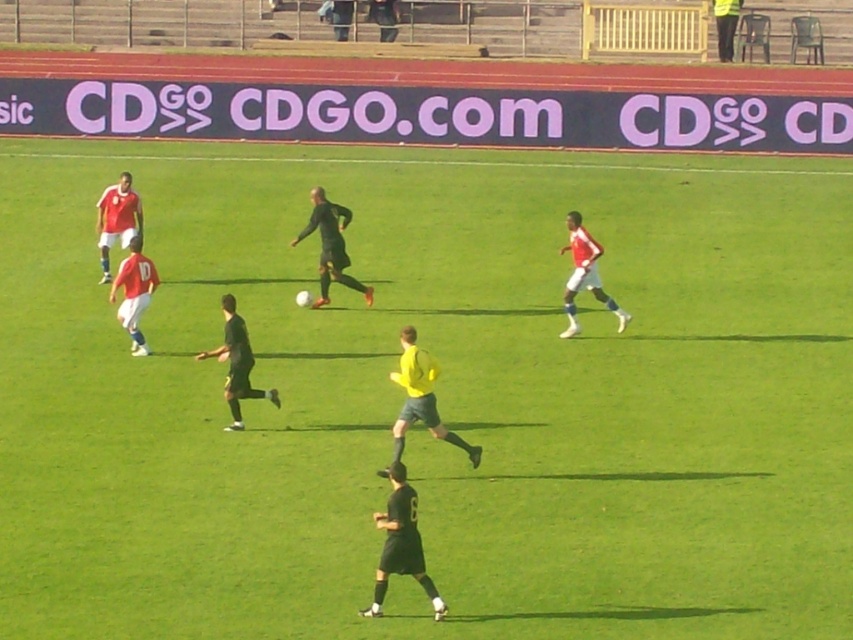
Does matte red jersey at upper left have a lesser height compared to matte red jersey at left?

Yes.

Is matte red jersey at upper left further to camera compared to matte red jersey at left?

Yes, matte red jersey at upper left is behind matte red jersey at left.

Where is `matte red jersey at upper left`? This screenshot has height=640, width=853. matte red jersey at upper left is located at coordinates pos(115,220).

The width and height of the screenshot is (853, 640). What do you see at coordinates (329, 244) in the screenshot? I see `black matte soccer player at center` at bounding box center [329, 244].

Is point (316, 204) closer to viewer compared to point (115, 202)?

Yes, point (316, 204) is in front of point (115, 202).

The width and height of the screenshot is (853, 640). In order to click on black matte soccer player at center in this screenshot , I will do `click(329, 244)`.

Who is higher up, yellow matte shirt at center or matte red jersey at center?

→ matte red jersey at center

Locate an element on the screen. yellow matte shirt at center is located at coordinates pyautogui.click(x=421, y=397).

The height and width of the screenshot is (640, 853). What do you see at coordinates (421, 397) in the screenshot? I see `yellow matte shirt at center` at bounding box center [421, 397].

Locate an element on the screen. Image resolution: width=853 pixels, height=640 pixels. yellow matte shirt at center is located at coordinates (421, 397).